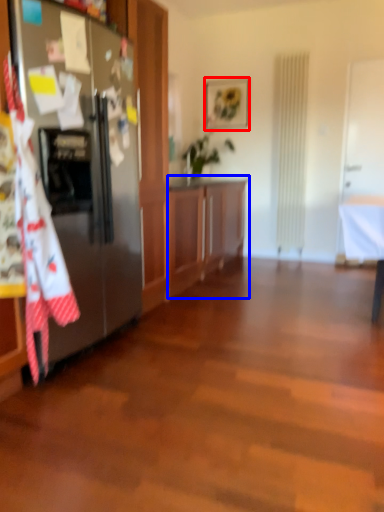
Question: Which object is closer to the camera taking this photo, picture frame (highlighted by a red box) or cabinetry (highlighted by a blue box)?

Choices:
 (A) picture frame
 (B) cabinetry

Answer: (B)